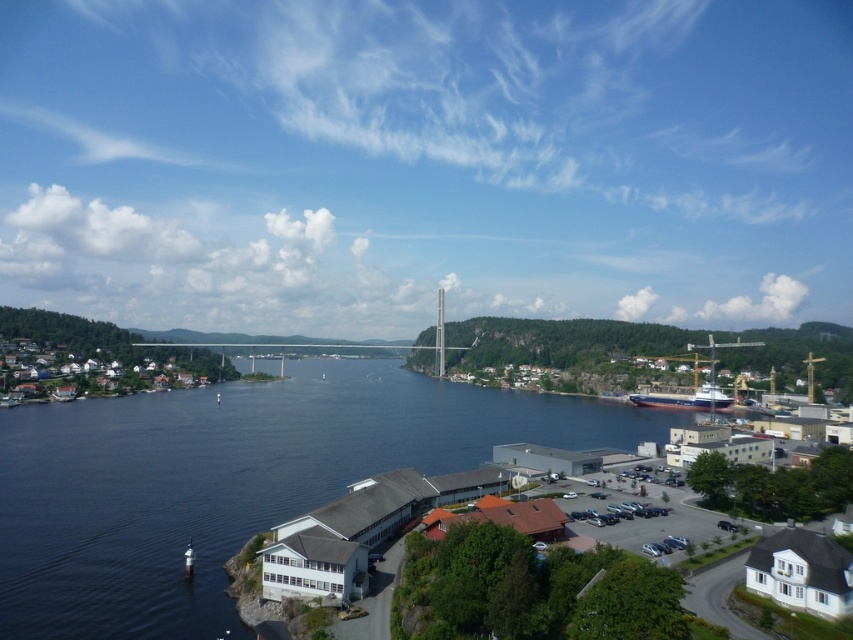
You are standing at the point closer to the camera between the two points, point (x=466, y=394) and point (x=637, y=394). Which point are you standing at?

You are standing at point (x=466, y=394) because it is further to the camera than point (x=637, y=394).

You are standing on the shore near the small cluster of buildings on the left. You want to take a photo of the blue metallic ship at lower right. Which direction should you turn to face the blue water at center while keeping the ship in your view?

You should turn to your left to face the blue water at center while keeping the blue metallic ship at lower right in your view, since the blue water at center is positioned to the left of the ship.